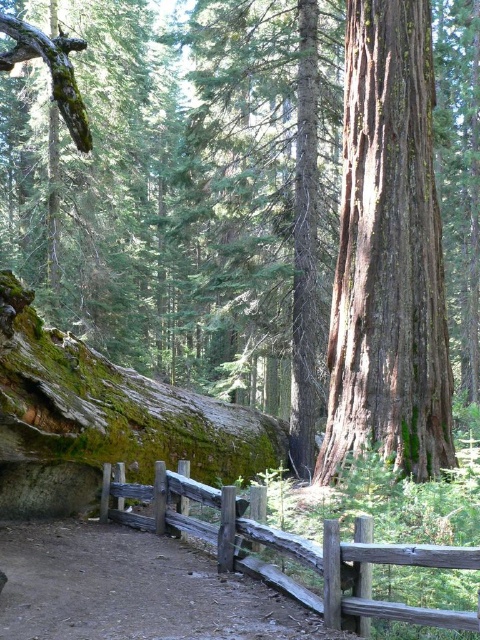
Question: Does smooth brown bark at center have a smaller size compared to dirt path at center?

Choices:
 (A) yes
 (B) no

Answer: (B)

Question: Can you confirm if dirt path at center is smaller than weathered wood fence at lower center?

Choices:
 (A) no
 (B) yes

Answer: (A)

Question: Is dirt path at center above weathered wood fence at lower center?

Choices:
 (A) no
 (B) yes

Answer: (A)

Question: Which point is farther to the camera?

Choices:
 (A) weathered wood fence at lower center
 (B) smooth brown bark at center
 (C) dirt path at center

Answer: (B)

Question: Among these points, which one is farthest from the camera?

Choices:
 (A) (372, 416)
 (B) (106, 512)

Answer: (B)

Question: Estimate the real-world distances between objects in this image. Which object is farther from the smooth brown bark at center?

Choices:
 (A) weathered wood fence at lower center
 (B) dirt path at center

Answer: (A)